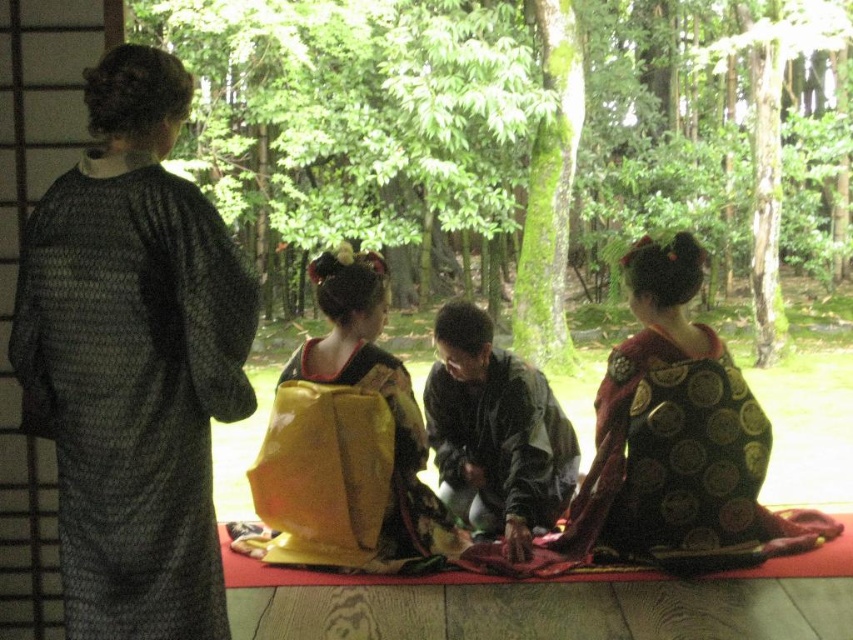
Is black silk kimono at center above dark green fabric at center?

Yes, black silk kimono at center is above dark green fabric at center.

Who is more distant from viewer, (695,326) or (515,499)?

A: The point (515,499) is more distant.

Is point (695, 444) positioned behind point (457, 468)?

No, it is in front of (457, 468).

The width and height of the screenshot is (853, 640). In order to click on black silk kimono at center in this screenshot , I will do `click(679, 436)`.

Does yellow satin kimono at center come in front of dark green fabric at center?

Yes, yellow satin kimono at center is in front of dark green fabric at center.

Is point (346, 296) farther from viewer compared to point (456, 316)?

No, (346, 296) is in front of (456, 316).

Who is more distant from viewer, (361, 524) or (498, 490)?

Positioned behind is point (498, 490).

You are a GUI agent. You are given a task and a screenshot of the screen. Output one action in this format:
    pyautogui.click(x=<x>, y=<y>)
    Task: Click on the yellow satin kimono at center
    This screenshot has width=853, height=640.
    Given the screenshot: What is the action you would take?
    pyautogui.click(x=346, y=442)

The width and height of the screenshot is (853, 640). I want to click on black textured robe at left, so click(132, 392).

Based on the photo, can you confirm if black textured robe at left is shorter than dark green fabric at center?

Incorrect, black textured robe at left's height does not fall short of dark green fabric at center's.

Locate an element on the screen. black textured robe at left is located at coordinates (132, 392).